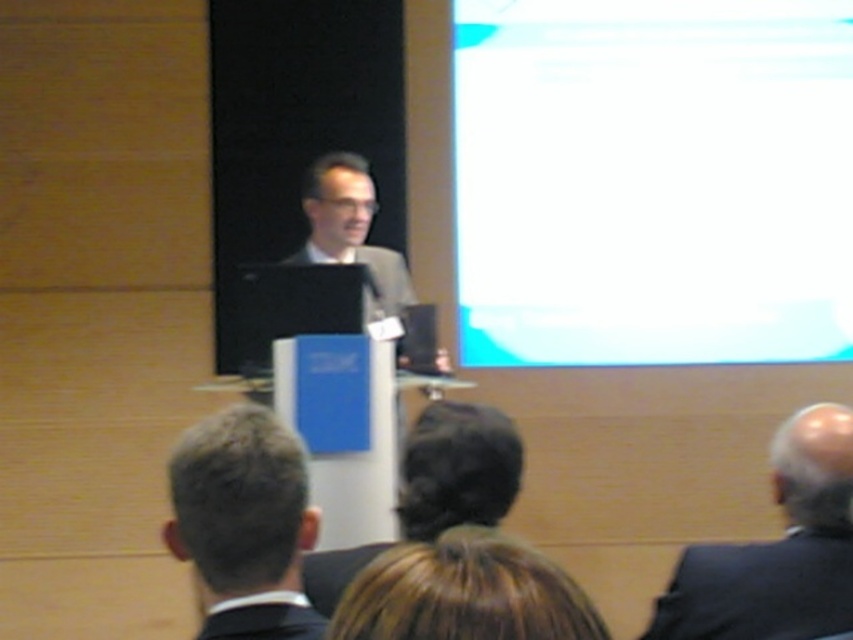
Describe the element at coordinates (759, 589) in the screenshot. I see `black matte suit at lower right` at that location.

Does black matte suit at lower right appear over matte gray suit at center?

Incorrect, black matte suit at lower right is not positioned above matte gray suit at center.

The width and height of the screenshot is (853, 640). What do you see at coordinates (759, 589) in the screenshot?
I see `black matte suit at lower right` at bounding box center [759, 589].

You are a GUI agent. You are given a task and a screenshot of the screen. Output one action in this format:
    pyautogui.click(x=<x>, y=<y>)
    Task: Click on the black matte suit at lower right
    Image resolution: width=853 pixels, height=640 pixels.
    Given the screenshot: What is the action you would take?
    pyautogui.click(x=759, y=589)

Which is behind, point (753, 93) or point (259, 474)?

The point (753, 93) is behind.

Is point (653, 272) farther from viewer compared to point (225, 483)?

Yes.

In order to click on white glossy projection screen at upper right in this screenshot , I will do `click(653, 180)`.

The height and width of the screenshot is (640, 853). I want to click on white glossy projection screen at upper right, so click(653, 180).

Which of these two, dark gray suit at center or black matte suit at lower center, stands taller?

With more height is dark gray suit at center.

Describe the element at coordinates (244, 524) in the screenshot. The image size is (853, 640). I see `dark gray suit at center` at that location.

Where is `dark gray suit at center`? The width and height of the screenshot is (853, 640). dark gray suit at center is located at coordinates (244, 524).